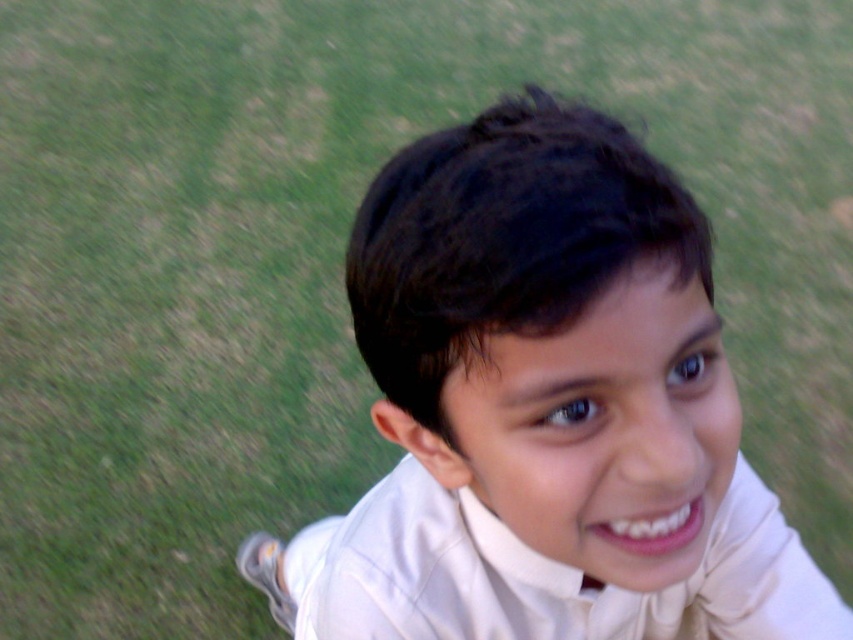
You are a photographer trying to decide which shirt to recommend for a client based on their preference for a more fitted look. Given that both the smooth white shirt at center and the white satin dress shirt at center are available, which one would you suggest?

The smooth white shirt at center has a lesser width compared to the white satin dress shirt at center, so it is more fitted and would be the better recommendation for a more fitted look.

The boy is wearing two shirts. Which one is closer to you, the smooth white shirt at center or the white satin dress shirt at center?

The smooth white shirt at center is closer to the viewer than the white satin dress shirt at center.